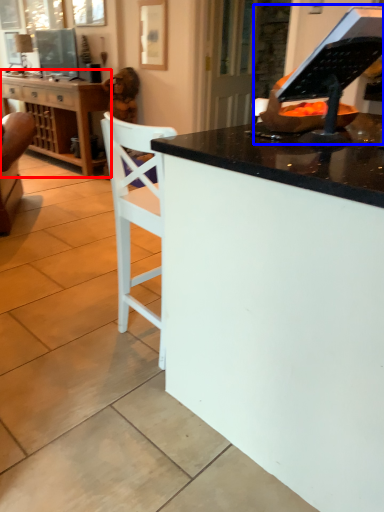
Question: Among these objects, which one is farthest to the camera, cabinetry (highlighted by a red box) or appliance (highlighted by a blue box)?

Choices:
 (A) cabinetry
 (B) appliance

Answer: (A)